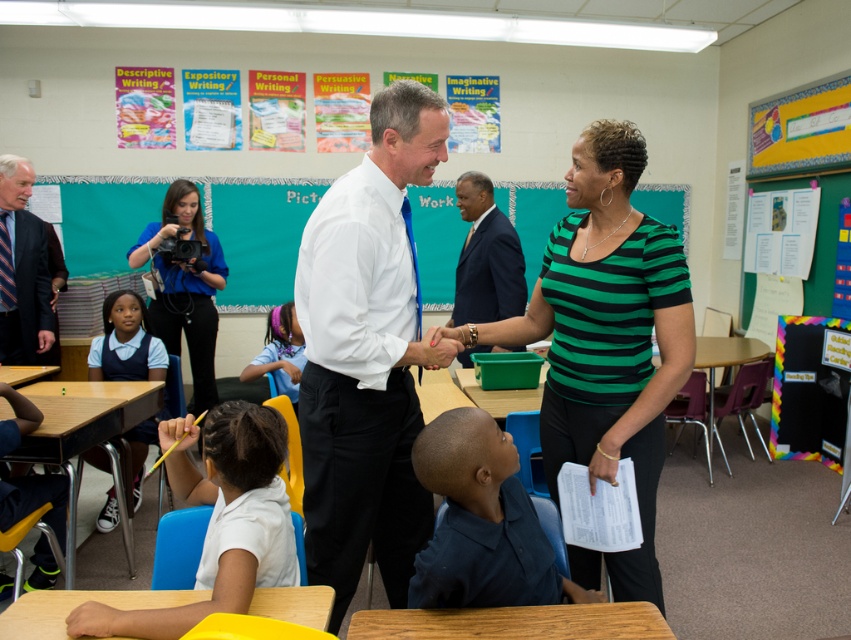
Question: Is white shirt at center wider than white uniform at lower left?

Choices:
 (A) yes
 (B) no

Answer: (A)

Question: Which of the following is the farthest from the observer?

Choices:
 (A) white uniform at lower left
 (B) dark blue suit at center
 (C) purple shiny hairband at center

Answer: (C)

Question: Is dark blue suit at left below white uniform at lower left?

Choices:
 (A) yes
 (B) no

Answer: (B)

Question: Which point is closer to the camera?

Choices:
 (A) dark blue suit at left
 (B) dark blue shirt at lower center
 (C) white paper at lower left

Answer: (C)

Question: Which point is farther from the camera taking this photo?

Choices:
 (A) (124, 362)
 (B) (458, 195)
 (C) (20, 177)
 (D) (216, 397)

Answer: (D)

Question: Does green striped shirt at center lie in front of dark blue suit at left?

Choices:
 (A) yes
 (B) no

Answer: (A)